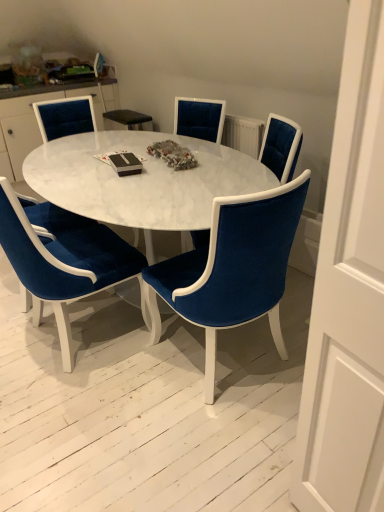
Question: From the image's perspective, is velvet blue chair at center, which is the fourth chair in left-to-right order, beneath velvet blue chair at center, which appears as the 2th chair when viewed from the left?

Choices:
 (A) yes
 (B) no

Answer: (A)

Question: From the image's perspective, would you say velvet blue chair at center, which is the fourth chair in left-to-right order, is positioned over velvet blue chair at center, the fourth chair when ordered from right to left?

Choices:
 (A) no
 (B) yes

Answer: (A)

Question: Can you confirm if velvet blue chair at center, which is the fourth chair in left-to-right order, is bigger than velvet blue chair at center, the fourth chair when ordered from right to left?

Choices:
 (A) yes
 (B) no

Answer: (B)

Question: From a real-world perspective, does velvet blue chair at center, the second chair in the right-to-left sequence, stand above velvet blue chair at center, which appears as the 2th chair when viewed from the left?

Choices:
 (A) no
 (B) yes

Answer: (A)

Question: From a real-world perspective, is velvet blue chair at center, the second chair in the right-to-left sequence, under velvet blue chair at center, the fourth chair when ordered from right to left?

Choices:
 (A) no
 (B) yes

Answer: (B)

Question: Considering their positions, is velvet blue chair at center, which is counted as the 5th chair, starting from the left, located in front of or behind velvet blue chair at upper left, which appears as the 1th chair when viewed from the left?

Choices:
 (A) front
 (B) behind

Answer: (A)

Question: From a real-world perspective, is velvet blue chair at center, which is counted as the 5th chair, starting from the left, physically located above or below velvet blue chair at upper left, which is counted as the 5th chair, starting from the right?

Choices:
 (A) below
 (B) above

Answer: (A)

Question: Would you say velvet blue chair at center, which is counted as the 5th chair, starting from the left, is to the left or to the right of velvet blue chair at upper left, which is counted as the 5th chair, starting from the right, in the picture?

Choices:
 (A) left
 (B) right

Answer: (B)

Question: Is velvet blue chair at center, the first chair positioned from the right, spatially inside velvet blue chair at upper left, which is counted as the 5th chair, starting from the right, or outside of it?

Choices:
 (A) inside
 (B) outside

Answer: (B)

Question: Considering the positions of velvet blue chair at upper left, which is counted as the 5th chair, starting from the right, and velvet blue chair at center, the first chair positioned from the right, in the image, is velvet blue chair at upper left, which is counted as the 5th chair, starting from the right, bigger or smaller than velvet blue chair at center, the first chair positioned from the right,?

Choices:
 (A) big
 (B) small

Answer: (B)

Question: In terms of width, does velvet blue chair at upper left, which appears as the 1th chair when viewed from the left, look wider or thinner when compared to velvet blue chair at center, which is counted as the 5th chair, starting from the left?

Choices:
 (A) thin
 (B) wide

Answer: (A)

Question: Considering their positions, is velvet blue chair at upper left, which appears as the 1th chair when viewed from the left, located in front of or behind velvet blue chair at center, the first chair positioned from the right?

Choices:
 (A) front
 (B) behind

Answer: (B)

Question: From their relative heights in the image, would you say velvet blue chair at upper left, which is counted as the 5th chair, starting from the right, is taller or shorter than velvet blue chair at center, which is counted as the 5th chair, starting from the left?

Choices:
 (A) short
 (B) tall

Answer: (A)

Question: From the image's perspective, is velvet blue chair at center, the first chair positioned from the right, positioned above or below white marble coffee table at center?

Choices:
 (A) below
 (B) above

Answer: (B)

Question: From a real-world perspective, is velvet blue chair at center, the first chair positioned from the right, physically located above or below white marble coffee table at center?

Choices:
 (A) below
 (B) above

Answer: (B)